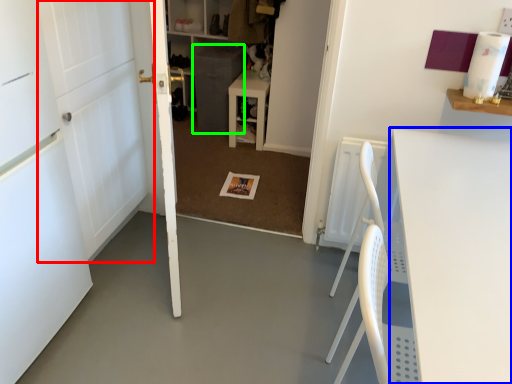
Question: Which object is the closest to the door (highlighted by a red box)? Choose among these: table (highlighted by a blue box) or cabinetry (highlighted by a green box).

Choices:
 (A) table
 (B) cabinetry

Answer: (A)